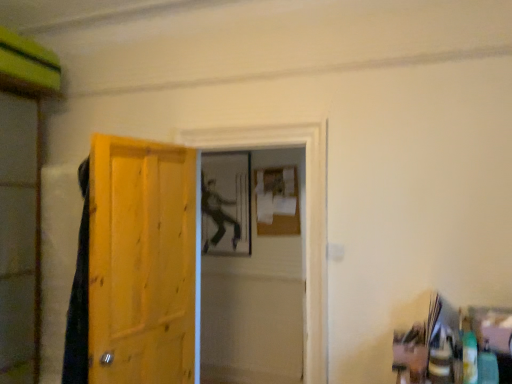
Question: Should I look upward or downward to see wooden door at left?

Choices:
 (A) down
 (B) up

Answer: (A)

Question: Is transparent plastic screen door at left, placed as the 2th screen door when sorted from right to left, located outside matte wooden screen door at center, which is the 1th screen door from right to left?

Choices:
 (A) yes
 (B) no

Answer: (A)

Question: From a real-world perspective, is transparent plastic screen door at left, placed as the 2th screen door when sorted from right to left, positioned over matte wooden screen door at center, marked as the second screen door in a left-to-right arrangement, based on gravity?

Choices:
 (A) no
 (B) yes

Answer: (B)

Question: Considering the relative sizes of transparent plastic screen door at left, positioned as the 1th screen door in left-to-right order, and matte wooden screen door at center, marked as the second screen door in a left-to-right arrangement, in the image provided, is transparent plastic screen door at left, positioned as the 1th screen door in left-to-right order, smaller than matte wooden screen door at center, marked as the second screen door in a left-to-right arrangement,?

Choices:
 (A) no
 (B) yes

Answer: (A)

Question: Does transparent plastic screen door at left, placed as the 2th screen door when sorted from right to left, come in front of matte wooden screen door at center, which is the 1th screen door from right to left?

Choices:
 (A) yes
 (B) no

Answer: (A)

Question: Could you tell me if transparent plastic screen door at left, positioned as the 1th screen door in left-to-right order, is facing matte wooden screen door at center, marked as the second screen door in a left-to-right arrangement?

Choices:
 (A) yes
 (B) no

Answer: (B)

Question: Is transparent plastic screen door at left, placed as the 2th screen door when sorted from right to left, taller than matte wooden screen door at center, marked as the second screen door in a left-to-right arrangement?

Choices:
 (A) no
 (B) yes

Answer: (B)

Question: Considering the relative sizes of matte black figure at center and wooden door at left in the image provided, is matte black figure at center smaller than wooden door at left?

Choices:
 (A) yes
 (B) no

Answer: (A)

Question: Is matte black figure at center positioned beyond the bounds of wooden door at left?

Choices:
 (A) yes
 (B) no

Answer: (A)

Question: From a real-world perspective, is matte black figure at center physically below wooden door at left?

Choices:
 (A) no
 (B) yes

Answer: (A)

Question: Considering the relative sizes of matte black figure at center and wooden door at left in the image provided, is matte black figure at center wider than wooden door at left?

Choices:
 (A) yes
 (B) no

Answer: (B)

Question: Can you confirm if matte black figure at center is taller than wooden door at left?

Choices:
 (A) no
 (B) yes

Answer: (A)

Question: Does matte black figure at center appear on the right side of wooden door at left?

Choices:
 (A) yes
 (B) no

Answer: (A)

Question: Is matte wooden screen door at center, marked as the second screen door in a left-to-right arrangement, positioned before matte black figure at center?

Choices:
 (A) no
 (B) yes

Answer: (B)